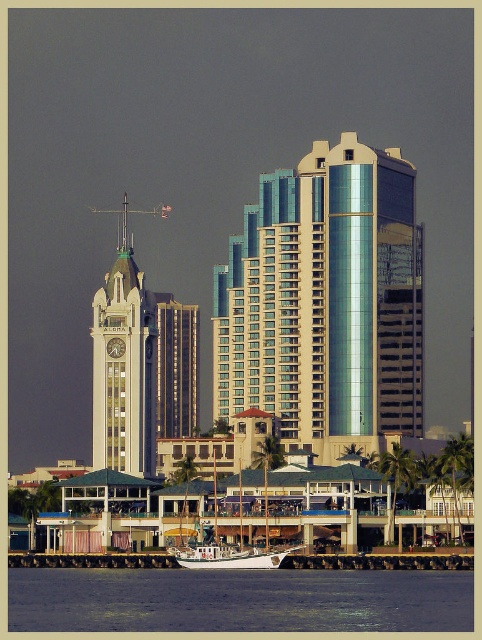
You are a photographer planning to capture the shiny glass building at center and the white matte boat at lower center in a single shot. Based on their positions, which object should you focus on first to ensure both are in frame?

The shiny glass building at center is located above the white matte boat at lower center, so you should focus on the white matte boat at lower center first to ensure both are in frame.